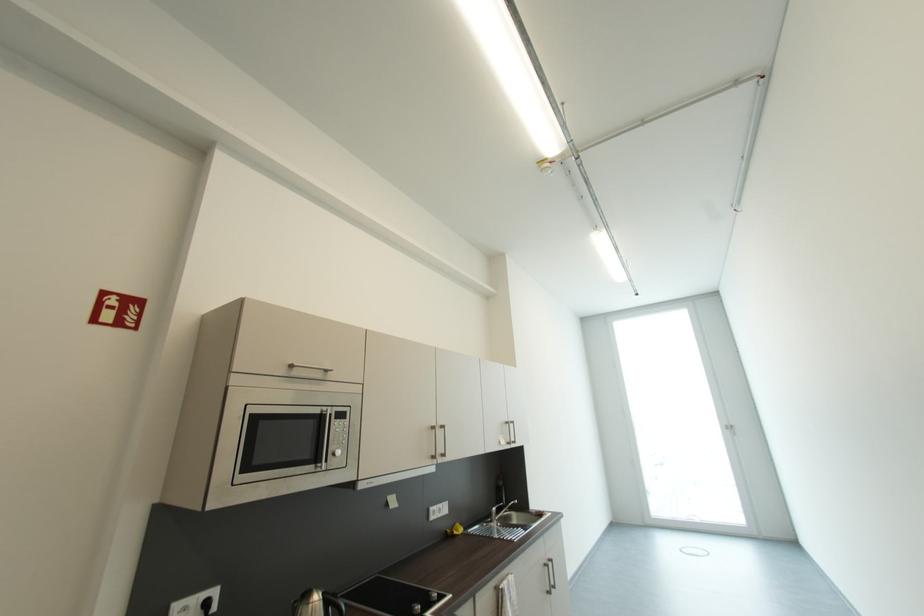
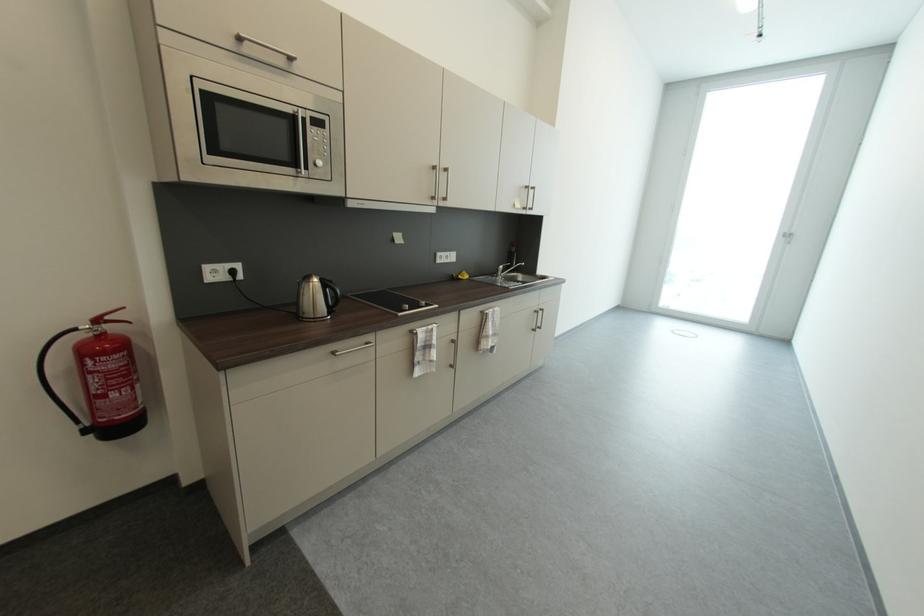
Question: How did the camera likely rotate?

Choices:
 (A) Left
 (B) Right
 (C) Up
 (D) Down

Answer: (D)